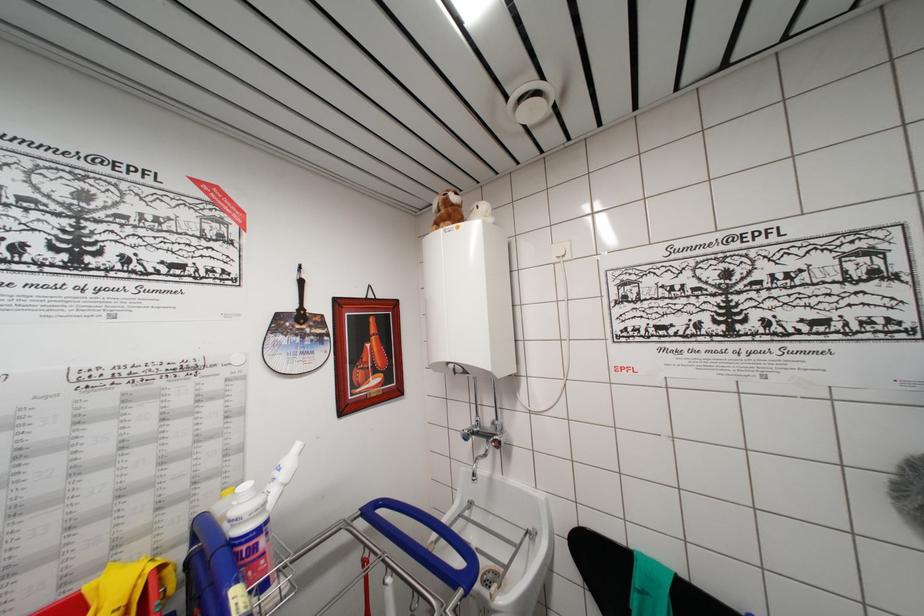
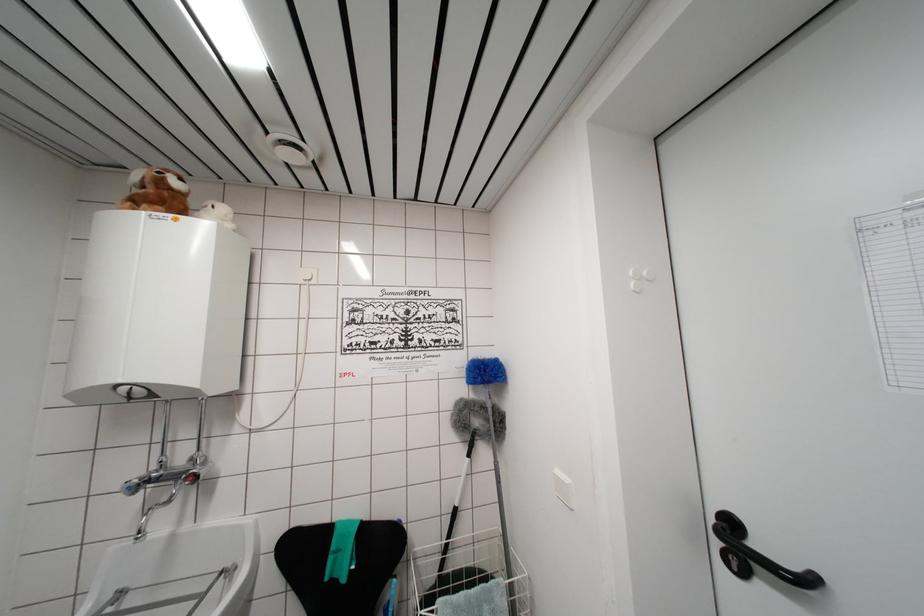
Locate, in the second image, the point that corresponds to (x=468, y=440) in the first image.

(132, 493)